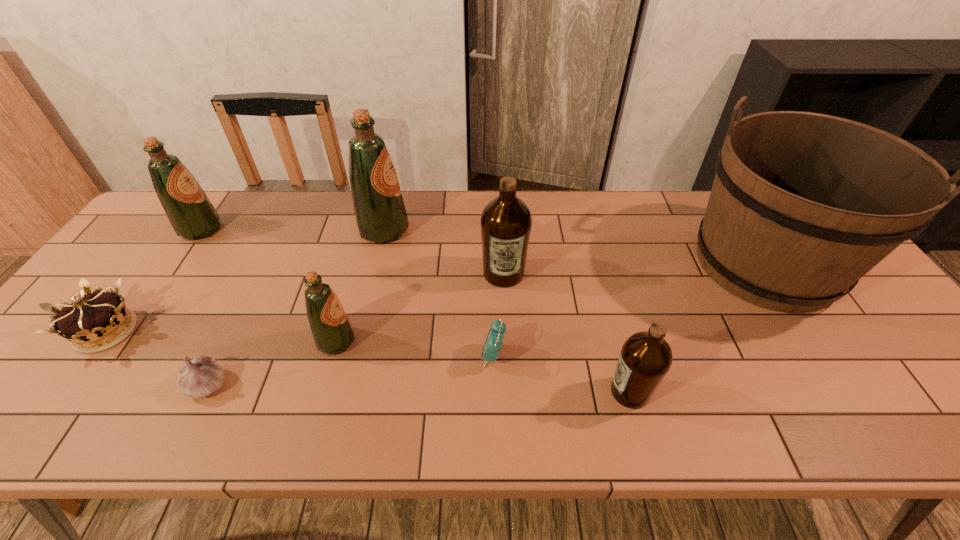
In order to click on the rightmost object in this screenshot , I will do `click(803, 205)`.

Find the location of a particular element. The image size is (960, 540). the biggest green olive oil is located at coordinates (380, 214).

Identify the location of the leftmost olive oil. (191, 214).

You are a GUI agent. You are given a task and a screenshot of the screen. Output one action in this format:
    pyautogui.click(x=<x>, y=<y>)
    Task: Click on the leftmost green olive oil
    The height and width of the screenshot is (540, 960).
    Given the screenshot: What is the action you would take?
    (x=191, y=214)

Where is `the third nearest olive oil`? Image resolution: width=960 pixels, height=540 pixels. the third nearest olive oil is located at coordinates (506, 221).

You are a GUI agent. You are given a task and a screenshot of the screen. Output one action in this format:
    pyautogui.click(x=<x>, y=<y>)
    Task: Click on the farther brown olive oil
    This screenshot has height=540, width=960.
    Given the screenshot: What is the action you would take?
    pyautogui.click(x=506, y=221)

Where is `the nearest green olive oil`? the nearest green olive oil is located at coordinates (331, 329).

This screenshot has width=960, height=540. What are the coordinates of `the fourth farthest olive oil` in the screenshot? It's located at (x=331, y=329).

This screenshot has width=960, height=540. Identify the location of the nearest olive oil. (645, 358).

Find the location of a particular element. The width and height of the screenshot is (960, 540). the smaller brown olive oil is located at coordinates (645, 358).